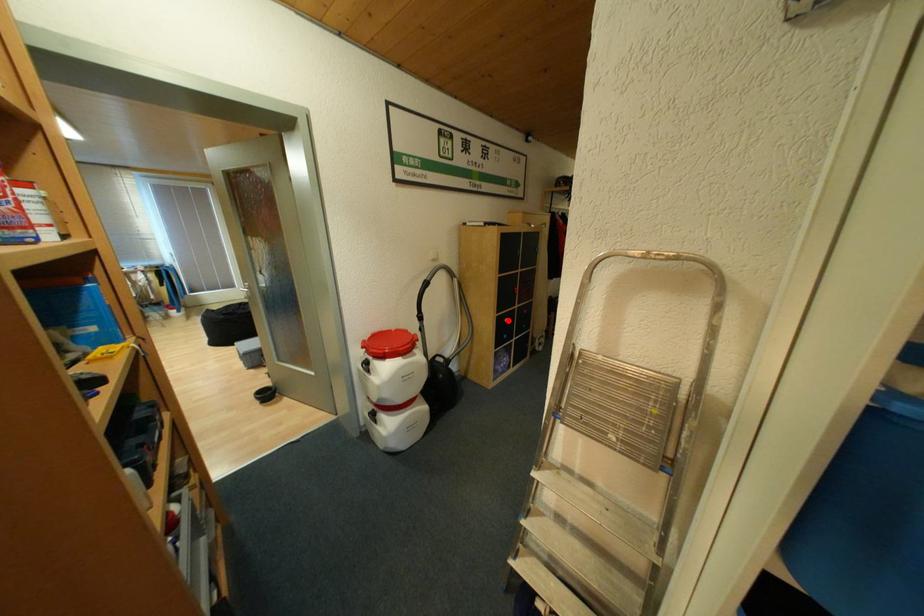
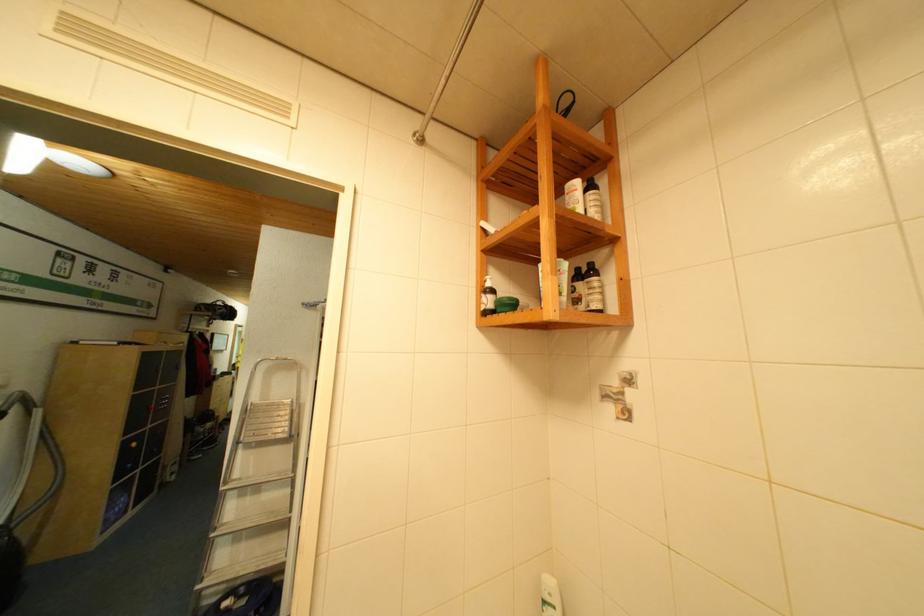
Where in the second image is the point corresponding to the highlighted location from the first image?

(136, 445)